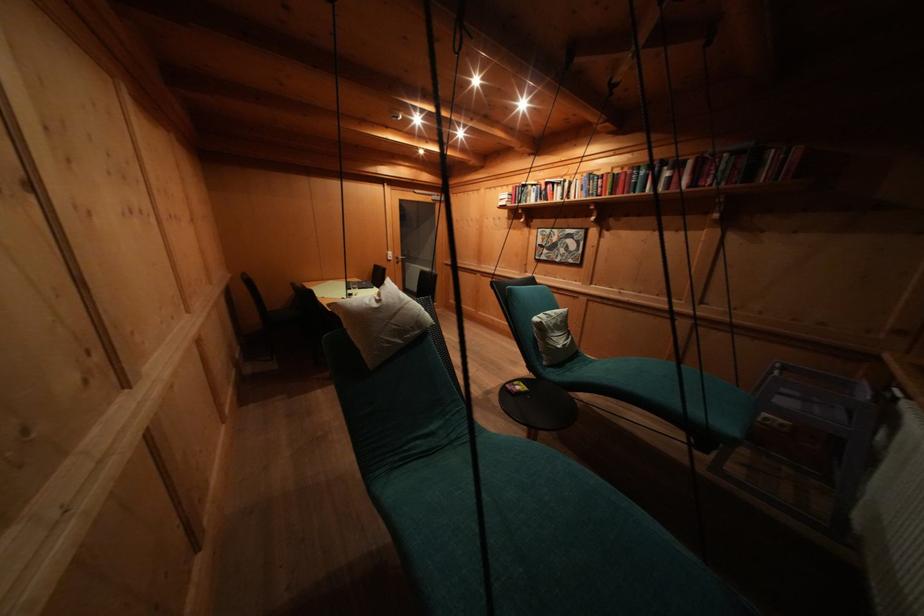
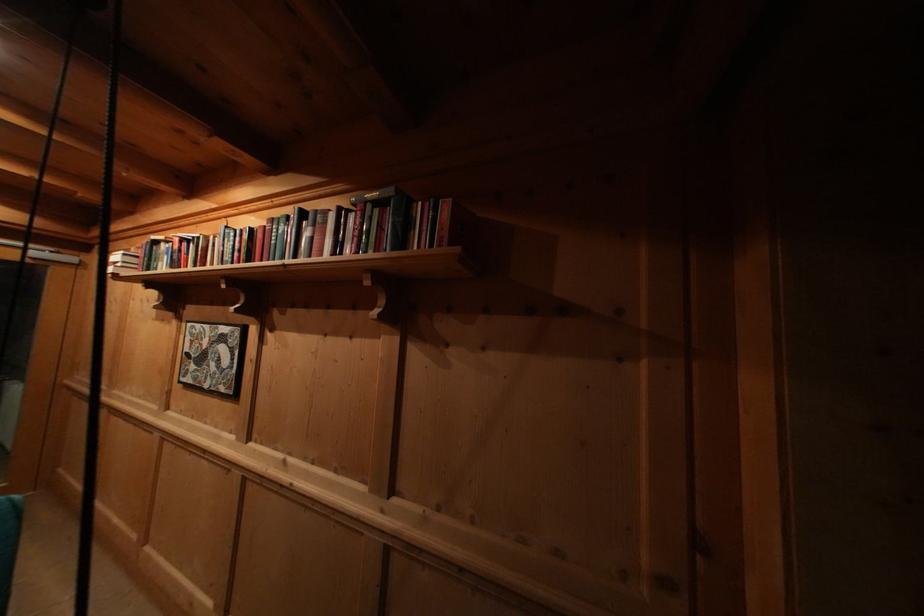
Find the pixel in the second image that matches (553,236) in the first image.

(204, 331)